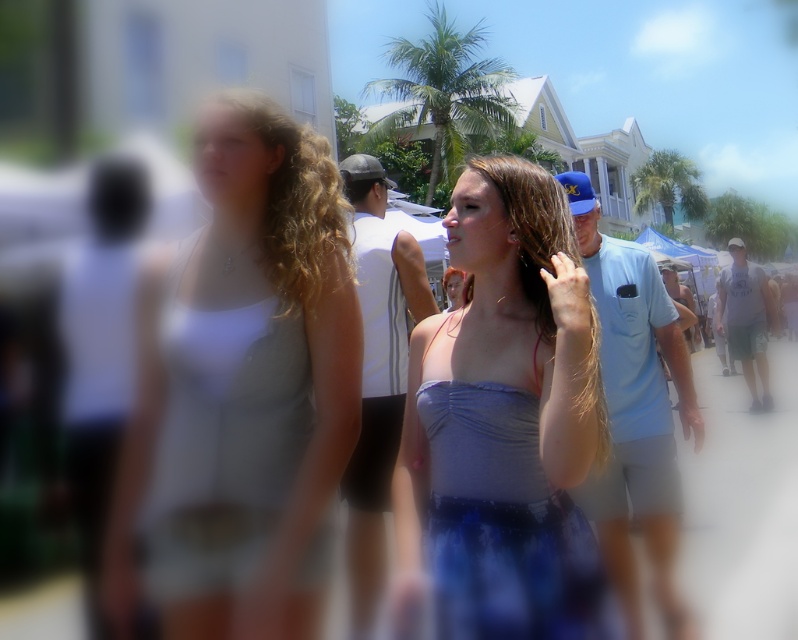
Question: Does matte blue dress at center have a smaller size compared to curly blonde hair at center?

Choices:
 (A) no
 (B) yes

Answer: (A)

Question: Among these points, which one is farthest from the camera?

Choices:
 (A) (524, 529)
 (B) (377, 179)

Answer: (B)

Question: Which object is the farthest from the brown curly hair at center?

Choices:
 (A) curly blonde hair at center
 (B) satin blue dress at center
 (C) blonde silky hair at center

Answer: (B)

Question: Which of the following is the farthest from the observer?

Choices:
 (A) curly blonde hair at center
 (B) blonde silky hair at center
 (C) white fabric top at left

Answer: (A)

Question: Does white fabric top at left have a greater width compared to matte blue dress at center?

Choices:
 (A) yes
 (B) no

Answer: (A)

Question: Is blonde silky hair at center smaller than brown curly hair at center?

Choices:
 (A) yes
 (B) no

Answer: (B)